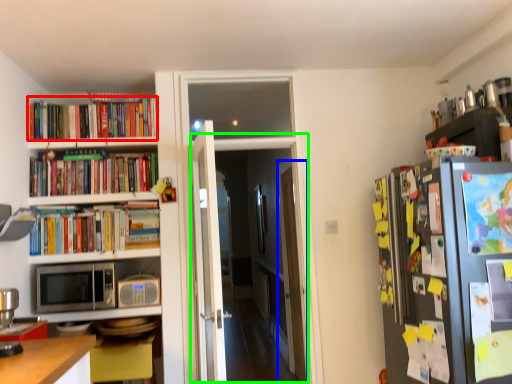
Question: Which is nearer to the book (highlighted by a red box)? glass door (highlighted by a blue box) or glass door (highlighted by a green box).

Choices:
 (A) glass door
 (B) glass door

Answer: (A)